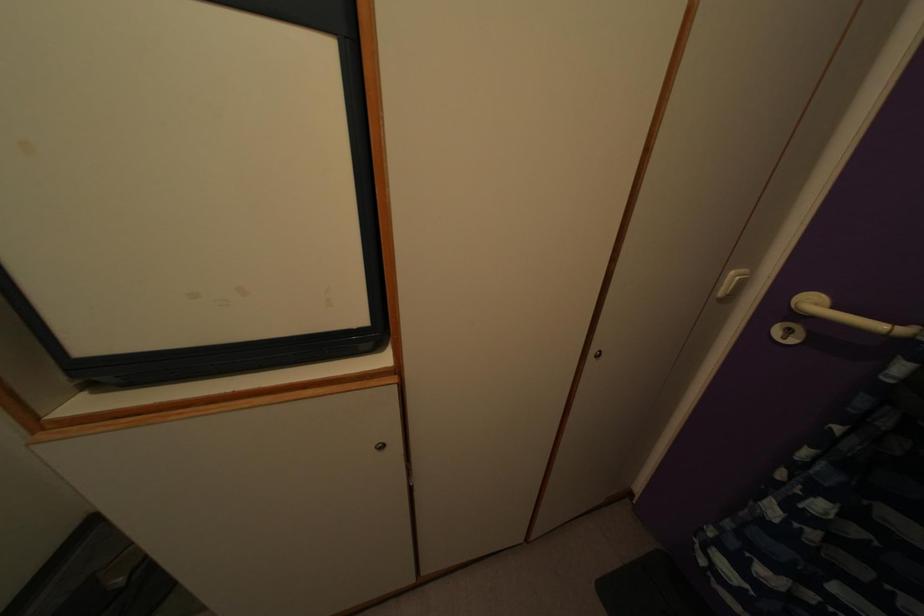
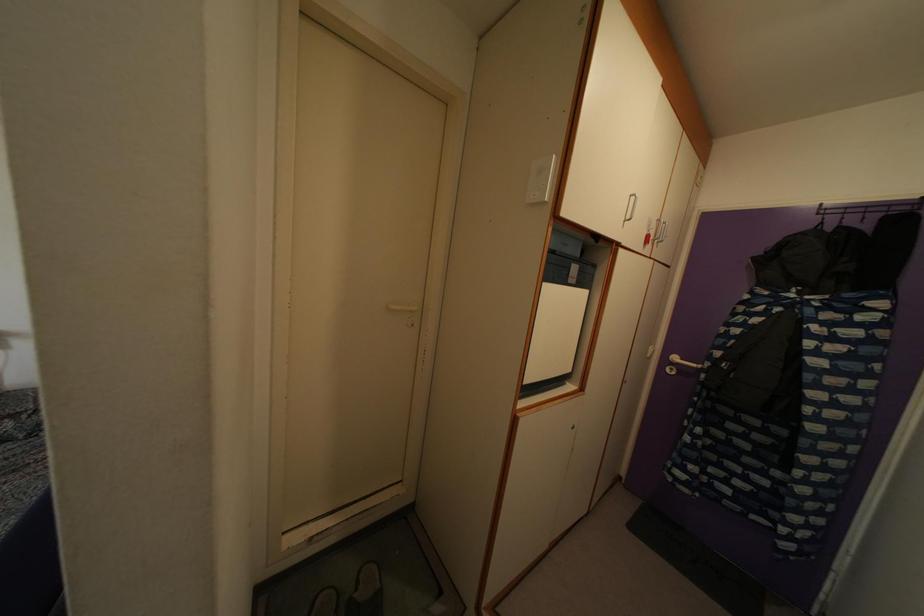
Which direction would the cameraman need to move to produce the second image?

The cameraman walked toward left, backward.